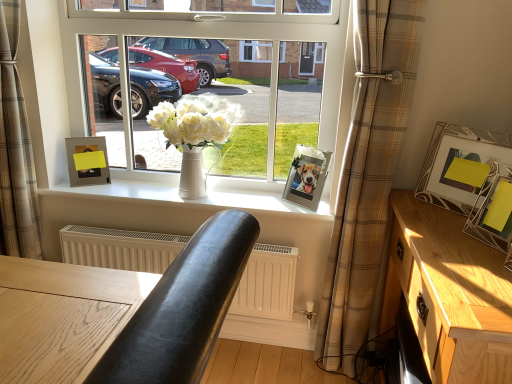
Where is `metallic silver photo frame at center, the second picture frame viewed from the back`? The height and width of the screenshot is (384, 512). metallic silver photo frame at center, the second picture frame viewed from the back is located at coordinates (307, 176).

In order to face matte silver picture frame at upper left, marked as the 1th picture frame in a back-to-front arrangement, should I rotate leftwards or rightwards?

Rotate your view left by about 21.411°.

I want to click on metallic silver picture frame at right, marked as the 3th picture frame in a back-to-front arrangement, so click(464, 164).

Does light wood/dark finish cabinet at right, which ranks as the second table in left-to-right order, have a greater width compared to metallic silver picture frame at right, the 2th picture frame viewed from the right?

Indeed, light wood/dark finish cabinet at right, which ranks as the second table in left-to-right order, has a greater width compared to metallic silver picture frame at right, the 2th picture frame viewed from the right.

From the image's perspective, is light wood/dark finish cabinet at right, which ranks as the second table in left-to-right order, above or below metallic silver picture frame at right, acting as the third picture frame starting from the left?

light wood/dark finish cabinet at right, which ranks as the second table in left-to-right order, is below metallic silver picture frame at right, acting as the third picture frame starting from the left.

From a real-world perspective, is light wood/dark finish cabinet at right, which ranks as the second table in front-to-back order, positioned over metallic silver picture frame at right, the 2th picture frame viewed from the right, based on gravity?

No.

How much distance is there between light wood/dark finish cabinet at right, which ranks as the second table in left-to-right order, and metallic silver picture frame at right, acting as the third picture frame starting from the left?

9.86 inches.

From the image's perspective, is light wood/dark finish cabinet at right, which ranks as the second table in left-to-right order, below white smooth vase at center?

Yes, from the image's perspective, light wood/dark finish cabinet at right, which ranks as the second table in left-to-right order, is below white smooth vase at center.

Considering the relative sizes of light wood/dark finish cabinet at right, which ranks as the second table in front-to-back order, and white smooth vase at center in the image provided, is light wood/dark finish cabinet at right, which ranks as the second table in front-to-back order, thinner than white smooth vase at center?

No.

From a real-world perspective, is light wood/dark finish cabinet at right, positioned as the first table in right-to-left order, physically located above or below white smooth vase at center?

Clearly, from a real-world perspective, light wood/dark finish cabinet at right, positioned as the first table in right-to-left order, is below white smooth vase at center.

Does light wood/dark finish cabinet at right, which ranks as the second table in front-to-back order, appear on the right side of white smooth vase at center?

Correct, you'll find light wood/dark finish cabinet at right, which ranks as the second table in front-to-back order, to the right of white smooth vase at center.

Is metallic silver photo frame at center, which is the second picture frame in left-to-right order, aimed at metallic silver picture frame at right, acting as the third picture frame starting from the left?

No, metallic silver photo frame at center, which is the second picture frame in left-to-right order, is not facing towards metallic silver picture frame at right, acting as the third picture frame starting from the left.

From a real-world perspective, is metallic silver photo frame at center, which is the second picture frame in left-to-right order, located higher than metallic silver picture frame at right, acting as the third picture frame starting from the left?

No.

Is metallic silver photo frame at center, which is the 3th picture frame in front-to-back order, with metallic silver picture frame at right, the 2th picture frame viewed from the right?

No, metallic silver photo frame at center, which is the 3th picture frame in front-to-back order, is not making contact with metallic silver picture frame at right, the 2th picture frame viewed from the right.

Consider the image. Which is more to the right, yellow paper picture frame at right, the first picture frame from the right, or white smooth vase at center?

From the viewer's perspective, yellow paper picture frame at right, the first picture frame from the right, appears more on the right side.

Between yellow paper picture frame at right, arranged as the fourth picture frame when viewed from the back, and white smooth vase at center, which one has more height?

Standing taller between the two is yellow paper picture frame at right, arranged as the fourth picture frame when viewed from the back.

From the image's perspective, relative to white smooth vase at center, is yellow paper picture frame at right, arranged as the fourth picture frame when viewed from the back, above or below?

yellow paper picture frame at right, arranged as the fourth picture frame when viewed from the back, is below white smooth vase at center.

From a real-world perspective, between yellow paper picture frame at right, which is the fourth picture frame in left-to-right order, and white smooth vase at center, who is vertically lower?

white smooth vase at center, from a real-world perspective.

Can you confirm if metallic silver picture frame at right, acting as the third picture frame starting from the left, is positioned to the left of white smooth vase at center?

No, metallic silver picture frame at right, acting as the third picture frame starting from the left, is not to the left of white smooth vase at center.

Measure the distance from metallic silver picture frame at right, acting as the third picture frame starting from the left, to white smooth vase at center.

64.21 centimeters.

Considering the sizes of objects plaid fabric curtain at center, which appears as the second curtain when viewed from the left, and matte silver picture frame at upper left, marked as the 1th picture frame in a back-to-front arrangement, in the image provided, who is bigger, plaid fabric curtain at center, which appears as the second curtain when viewed from the left, or matte silver picture frame at upper left, marked as the 1th picture frame in a back-to-front arrangement,?

With larger size is plaid fabric curtain at center, which appears as the second curtain when viewed from the left.

What are the coordinates of `the 1st picture frame positioned above the plaid fabric curtain at center, which appears as the second curtain when viewed from the left (from a real-world perspective)` in the screenshot? It's located at (87, 161).

From the image's perspective, which object appears higher, plaid fabric curtain at center, arranged as the 1th curtain when viewed from the right, or matte silver picture frame at upper left, which is counted as the 4th picture frame, starting from the right?

matte silver picture frame at upper left, which is counted as the 4th picture frame, starting from the right, appears higher in the image.

Is plaid fabric curtain at center, which appears as the second curtain when viewed from the left, next to matte silver picture frame at upper left, marked as the 1th picture frame in a back-to-front arrangement?

No, plaid fabric curtain at center, which appears as the second curtain when viewed from the left, is not touching matte silver picture frame at upper left, marked as the 1th picture frame in a back-to-front arrangement.

How many degrees apart are the facing directions of wooden table at center, placed as the second table when sorted from back to front, and white ceramic vase at center?

92.9 degrees.

Identify the location of houseplant that is on the right side of wooden table at center, placed as the second table when sorted from back to front. (194, 136).

Is wooden table at center, placed as the 1th table when sorted from front to back, taller or shorter than white ceramic vase at center?

Result: wooden table at center, placed as the 1th table when sorted from front to back, is taller than white ceramic vase at center.

Which of these two, wooden table at center, positioned as the 1th table in left-to-right order, or white ceramic vase at center, is thinner?

Thinner between the two is white ceramic vase at center.

Locate an element on the screen. This screenshot has height=384, width=512. table that is the 1st object to the left of the metallic silver picture frame at right, the 2th picture frame viewed from the right, starting at the anchor is located at coordinates (449, 293).

Locate an element on the screen. This screenshot has width=512, height=384. table beneath the white smooth vase at center (from a real-world perspective) is located at coordinates (449, 293).

When comparing their distances from yellow paper picture frame at right, which is counted as the 1th picture frame, starting from the front, does white smooth vase at center or plaid fabric curtain at center, arranged as the 1th curtain when viewed from the right, seem closer?

Among the two, plaid fabric curtain at center, arranged as the 1th curtain when viewed from the right, is located nearer to yellow paper picture frame at right, which is counted as the 1th picture frame, starting from the front.

Looking at the image, which one is located closer to white matte vase at center, beige plaid curtain at lower left, arranged as the first curtain when viewed from the left, or light wood/dark finish cabinet at right, positioned as the first table in right-to-left order?

Based on the image, beige plaid curtain at lower left, arranged as the first curtain when viewed from the left, appears to be nearer to white matte vase at center.

Consider the image. Based on their spatial positions, is matte silver picture frame at upper left, the 1th picture frame viewed from the left, or white matte vase at center closer to metallic silver picture frame at right, marked as the 3th picture frame in a back-to-front arrangement?

Based on the image, white matte vase at center appears to be nearer to metallic silver picture frame at right, marked as the 3th picture frame in a back-to-front arrangement.

When comparing their distances from yellow paper picture frame at right, the first picture frame from the right, does white ceramic vase at center or wooden table at center, positioned as the 1th table in left-to-right order, seem closer?

white ceramic vase at center lies closer to yellow paper picture frame at right, the first picture frame from the right, than the other object.

Looking at the image, which one is located closer to white ceramic vase at center, beige plaid curtain at lower left, arranged as the first curtain when viewed from the left, or metallic silver picture frame at right, acting as the 2th picture frame starting from the front?

Based on the image, beige plaid curtain at lower left, arranged as the first curtain when viewed from the left, appears to be nearer to white ceramic vase at center.

From the image, which object appears to be farther from metallic silver picture frame at right, the 2th picture frame viewed from the right, white matte radiator at lower center or yellow paper picture frame at right, arranged as the fourth picture frame when viewed from the back?

Based on the image, white matte radiator at lower center appears to be further to metallic silver picture frame at right, the 2th picture frame viewed from the right.

Estimate the real-world distances between objects in this image. Which object is closer to white matte vase at center, metallic silver picture frame at right, the 2th picture frame viewed from the right, or wooden table at center, positioned as the 1th table in left-to-right order?

metallic silver picture frame at right, the 2th picture frame viewed from the right, is closer to white matte vase at center.

Considering their positions, is white smooth vase at center positioned closer to white matte vase at center than wooden table at center, placed as the second table when sorted from back to front?

white smooth vase at center is positioned closer to the anchor white matte vase at center.

The height and width of the screenshot is (384, 512). I want to click on picture frame between beige plaid curtain at lower left, which ranks as the 2th curtain in right-to-left order, and white ceramic vase at center, so click(x=87, y=161).

What are the coordinates of `radiator between beige plaid curtain at lower left, which ranks as the 2th curtain in right-to-left order, and white smooth vase at center` in the screenshot? It's located at tap(120, 248).

Locate an element on the screen. Image resolution: width=512 pixels, height=384 pixels. curtain between beige plaid curtain at lower left, arranged as the first curtain when viewed from the left, and light wood/dark finish cabinet at right, which ranks as the second table in left-to-right order, from left to right is located at coordinates (368, 176).

This screenshot has height=384, width=512. I want to click on houseplant located between white smooth vase at center and light wood/dark finish cabinet at right, which ranks as the second table in front-to-back order, in the left-right direction, so click(x=194, y=136).